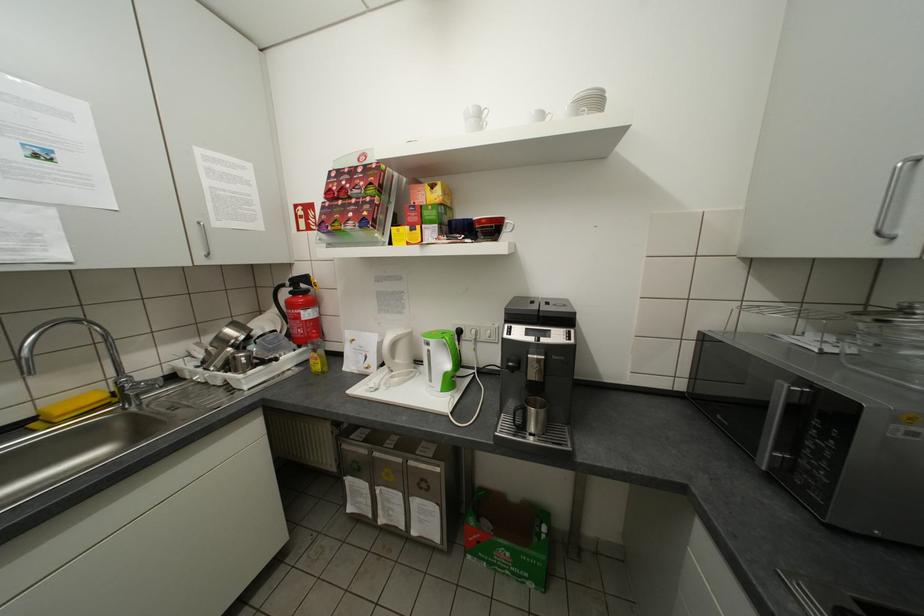
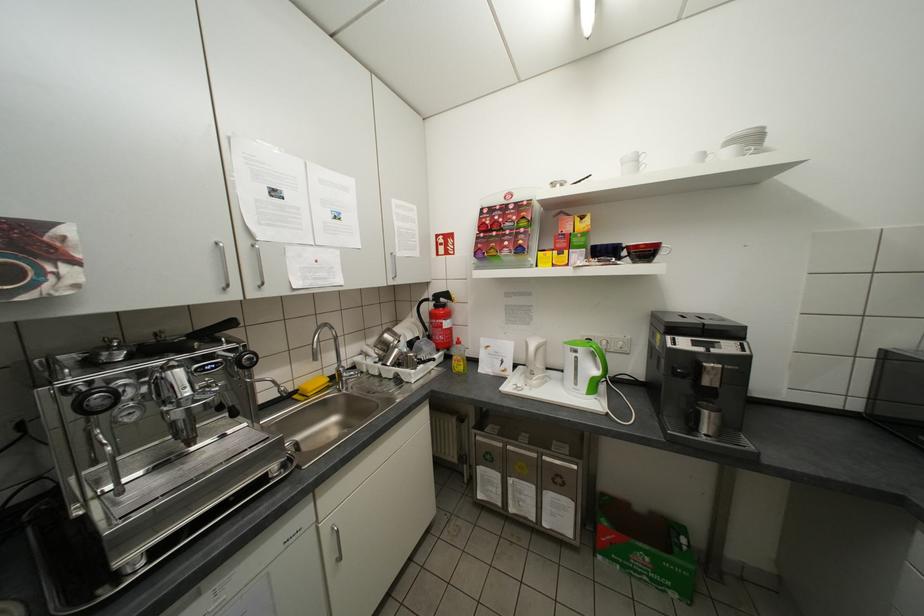
Find the pixel in the second image that matches point (406, 379) in the first image.

(543, 382)